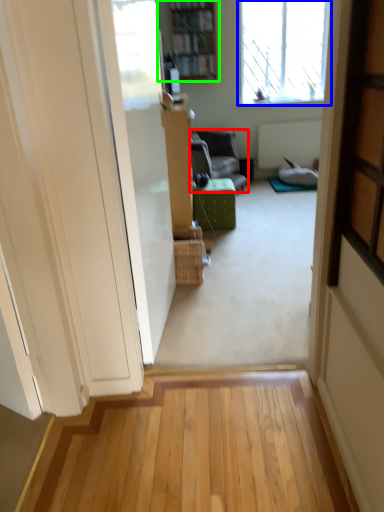
Question: Considering the real-world distances, which object is farthest from furniture (highlighted by a red box)? window (highlighted by a blue box) or bookcase (highlighted by a green box)?

Choices:
 (A) window
 (B) bookcase

Answer: (A)